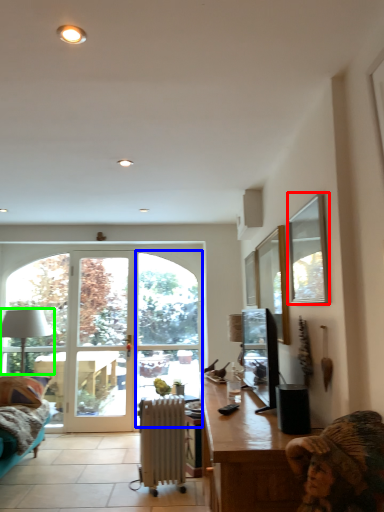
Question: Which object is the closest to the window screen (highlighted by a red box)? Choose among these: window (highlighted by a blue box) or lamp (highlighted by a green box).

Choices:
 (A) window
 (B) lamp

Answer: (A)